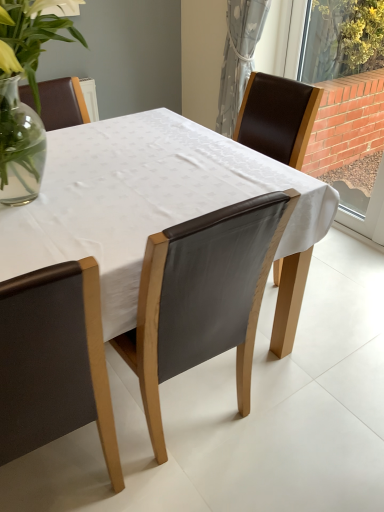
Question: Does brick wall at right turn towards white fabric table at center?

Choices:
 (A) no
 (B) yes

Answer: (B)

Question: Can you confirm if brick wall at right is smaller than white fabric table at center?

Choices:
 (A) no
 (B) yes

Answer: (B)

Question: From the image's perspective, is brick wall at right above white fabric table at center?

Choices:
 (A) no
 (B) yes

Answer: (B)

Question: Is brick wall at right positioned behind white fabric table at center?

Choices:
 (A) no
 (B) yes

Answer: (B)

Question: Is white fabric table at center completely or partially inside brick wall at right?

Choices:
 (A) no
 (B) yes

Answer: (A)

Question: Considering the relative sizes of brick wall at right and white fabric table at center in the image provided, is brick wall at right shorter than white fabric table at center?

Choices:
 (A) yes
 (B) no

Answer: (B)

Question: Does gray textured curtain at upper right have a greater height compared to leather at center, which appears as the second chair when viewed from the left?

Choices:
 (A) yes
 (B) no

Answer: (B)

Question: Can you confirm if gray textured curtain at upper right is positioned to the right of leather at center, which appears as the second chair when viewed from the left?

Choices:
 (A) yes
 (B) no

Answer: (A)

Question: Considering the relative positions of gray textured curtain at upper right and leather at center, which appears as the second chair when viewed from the left, in the image provided, is gray textured curtain at upper right behind leather at center, which appears as the second chair when viewed from the left,?

Choices:
 (A) yes
 (B) no

Answer: (A)

Question: From the image's perspective, is gray textured curtain at upper right on top of leather at center, which appears as the second chair when viewed from the left?

Choices:
 (A) no
 (B) yes

Answer: (B)

Question: Is gray textured curtain at upper right thinner than leather at center, which appears as the second chair when viewed from the left?

Choices:
 (A) no
 (B) yes

Answer: (B)

Question: Can you confirm if gray textured curtain at upper right is positioned to the left of leather at center, which appears as the second chair when viewed from the left?

Choices:
 (A) yes
 (B) no

Answer: (B)

Question: Is white fabric table at center at the left side of brick wall at right?

Choices:
 (A) no
 (B) yes

Answer: (B)